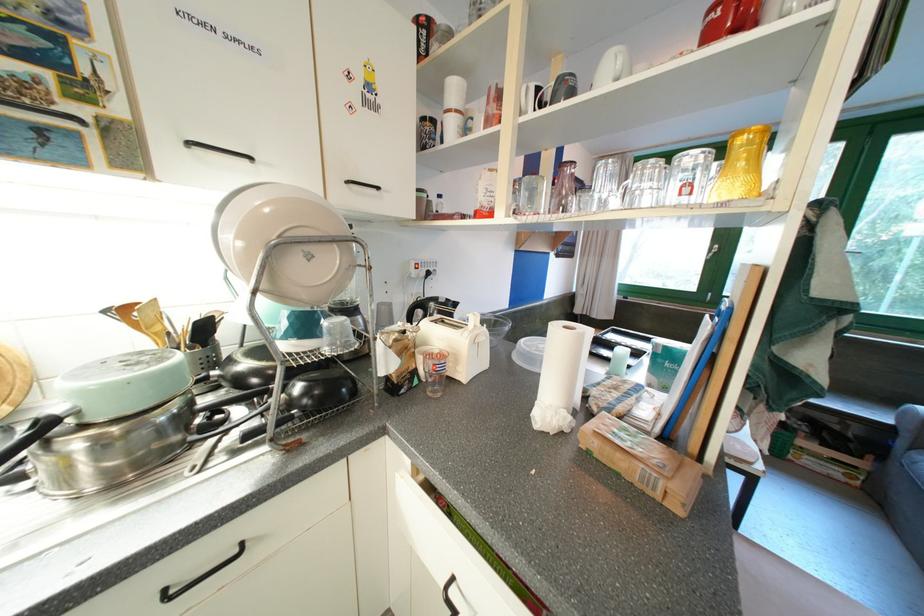
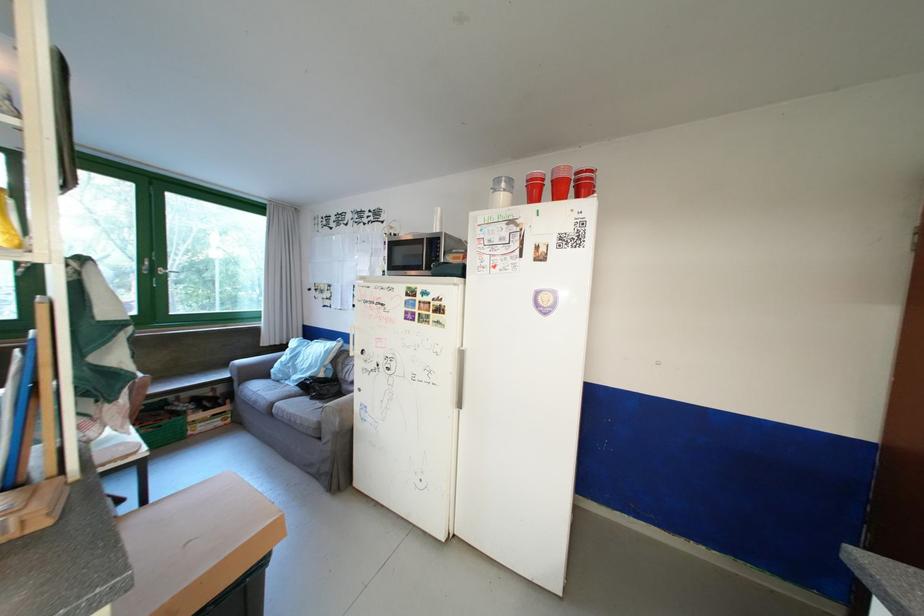
Question: How did the camera likely rotate?

Choices:
 (A) Left
 (B) Right
 (C) Up
 (D) Down

Answer: (B)